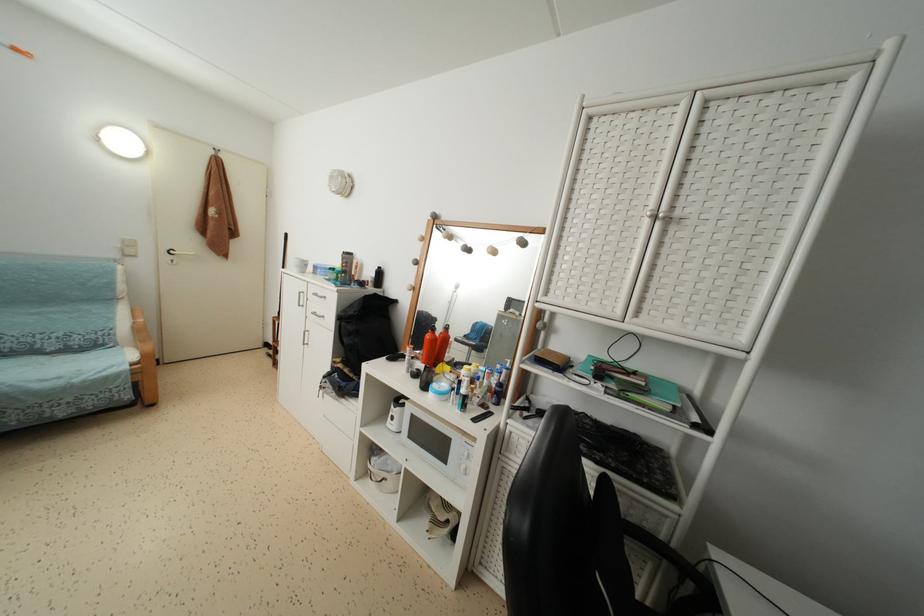
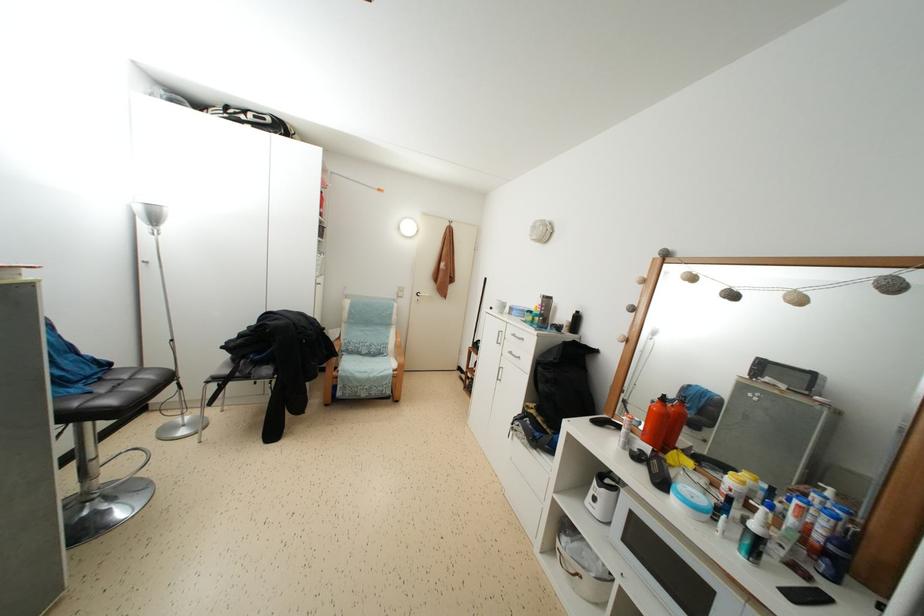
The point at [380,300] is marked in the first image. Where is the corresponding point in the second image?

(578, 347)